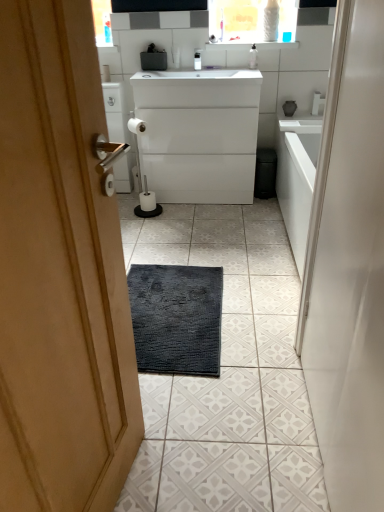
Question: Should I look upward or downward to see white glossy cabinet at center?

Choices:
 (A) up
 (B) down

Answer: (A)

Question: From the image's perspective, is white matte toilet paper at center, which is counted as the 1th toilet paper, starting from the right, beneath white glossy medicine cabinet at upper center?

Choices:
 (A) yes
 (B) no

Answer: (A)

Question: Considering the relative sizes of white matte toilet paper at center, the 2th toilet paper from the top, and white glossy medicine cabinet at upper center in the image provided, is white matte toilet paper at center, the 2th toilet paper from the top, smaller than white glossy medicine cabinet at upper center?

Choices:
 (A) yes
 (B) no

Answer: (A)

Question: Is white matte toilet paper at center, which is counted as the 1th toilet paper, starting from the right, oriented away from white glossy medicine cabinet at upper center?

Choices:
 (A) no
 (B) yes

Answer: (A)

Question: Considering the relative sizes of white matte toilet paper at center, which is counted as the 1th toilet paper, starting from the right, and white glossy medicine cabinet at upper center in the image provided, is white matte toilet paper at center, which is counted as the 1th toilet paper, starting from the right, thinner than white glossy medicine cabinet at upper center?

Choices:
 (A) no
 (B) yes

Answer: (B)

Question: Does white matte toilet paper at center, the 2th toilet paper from the top, have a lesser height compared to white glossy medicine cabinet at upper center?

Choices:
 (A) yes
 (B) no

Answer: (A)

Question: Is white matte toilet paper at center, the 1th toilet paper when ordered from bottom to top, surrounding white glossy medicine cabinet at upper center?

Choices:
 (A) no
 (B) yes

Answer: (A)

Question: Is white glossy medicine cabinet at upper center placed right next to white glossy cabinet at center?

Choices:
 (A) no
 (B) yes

Answer: (A)

Question: Is white glossy cabinet at center a part of white glossy medicine cabinet at upper center?

Choices:
 (A) no
 (B) yes

Answer: (A)

Question: From the image's perspective, is white glossy medicine cabinet at upper center below white glossy cabinet at center?

Choices:
 (A) yes
 (B) no

Answer: (B)

Question: Is white glossy medicine cabinet at upper center outside white glossy cabinet at center?

Choices:
 (A) no
 (B) yes

Answer: (B)

Question: From the image's perspective, is white glossy medicine cabinet at upper center on white glossy cabinet at center?

Choices:
 (A) yes
 (B) no

Answer: (A)

Question: Is white glossy medicine cabinet at upper center shorter than white glossy cabinet at center?

Choices:
 (A) no
 (B) yes

Answer: (B)

Question: Is transparent plastic bottle at upper center facing towards white matte toilet paper at center, the 2th toilet paper from the top?

Choices:
 (A) no
 (B) yes

Answer: (A)